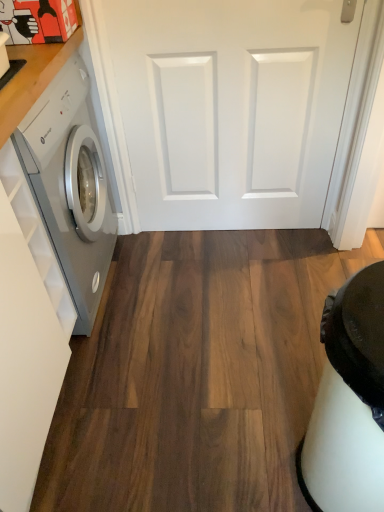
Where is `blank space to the left of white matte door at center`? The image size is (384, 512). blank space to the left of white matte door at center is located at coordinates (162, 266).